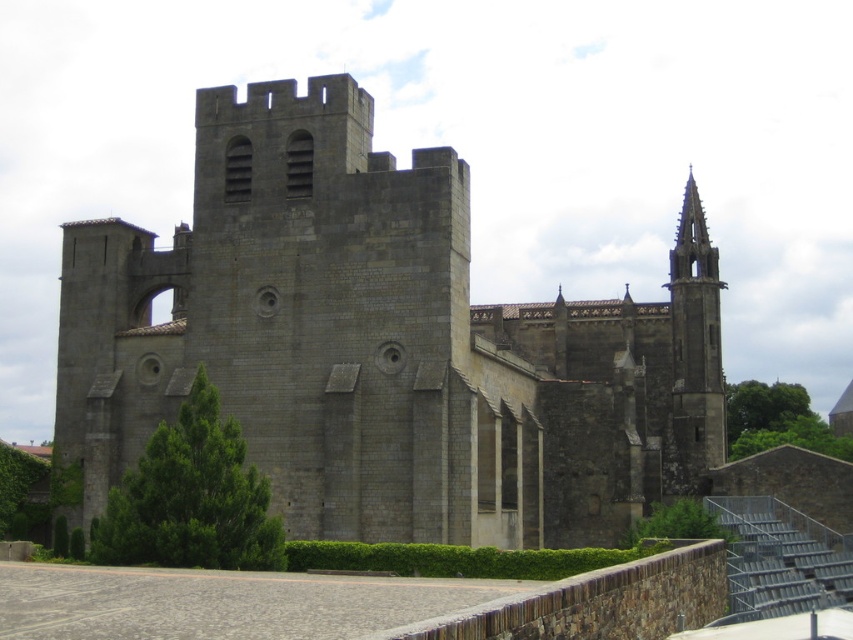
In the scene shown: You are standing in a field and see the gray stone castle at center. If you want to draw a map of the castle, where should you place it on the paper using coordinates?

You should place the gray stone castle at center at the coordinates point (381,344) on the paper.

You are standing in front of the historic stone building. You notice two points marked on the building. The first point is at coordinates point (427, 189) and the second is at point (674, 308). Which point is closer to you as you face the building?

Point (427, 189) is closer to you because it is in front of point (674, 308).

You are an architect assessing the height of two structures in the image. The gray stone castle at center and the smooth gray spire at upper right. Which one is taller?

The smooth gray spire at upper right is taller than the gray stone castle at center.